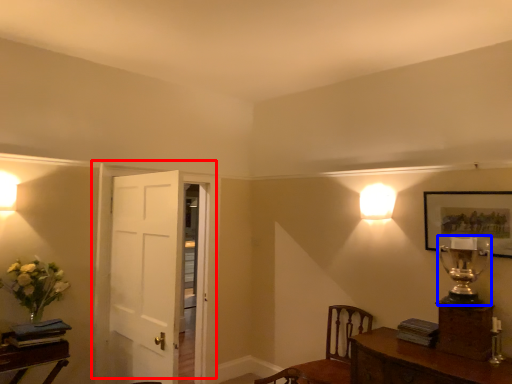
Question: Which object appears closest to the camera in this image, door (highlighted by a red box) or table lamp (highlighted by a blue box)?

Choices:
 (A) door
 (B) table lamp

Answer: (B)